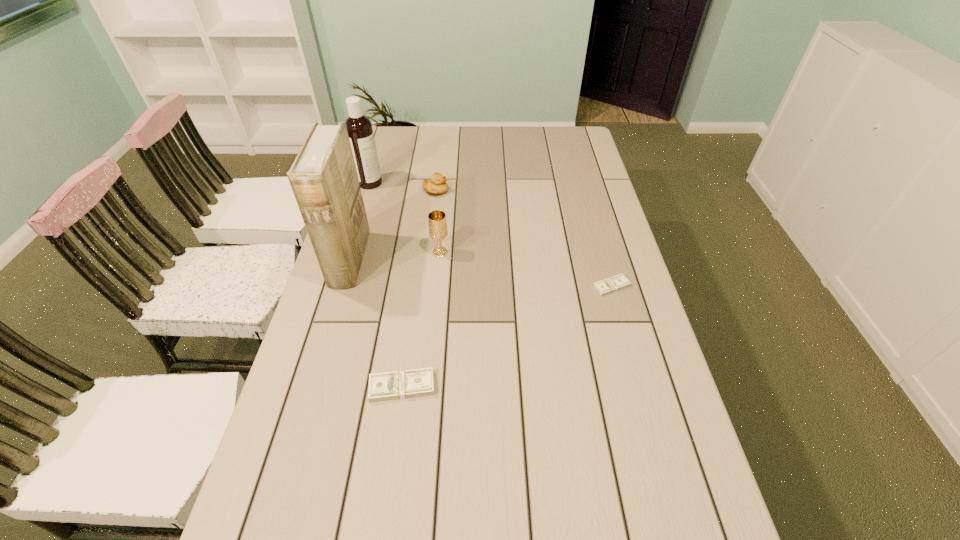
Where is `free location at the far right corner`? free location at the far right corner is located at coordinates (576, 143).

Identify the location of free space between the farther money and the third shortest object. The width and height of the screenshot is (960, 540). (523, 239).

You are a GUI agent. You are given a task and a screenshot of the screen. Output one action in this format:
    pyautogui.click(x=<x>, y=<y>)
    Task: Click on the free space between the dishwasher detergent and the nearest object
    This screenshot has height=540, width=960.
    Given the screenshot: What is the action you would take?
    pyautogui.click(x=386, y=285)

Find the location of `vacant region between the farther money and the fourth tallest object`. vacant region between the farther money and the fourth tallest object is located at coordinates (523, 239).

Where is `empty space between the second tallest object and the farther money`? This screenshot has height=540, width=960. empty space between the second tallest object and the farther money is located at coordinates (491, 234).

Find the location of a particular element. free point between the fourth shortest object and the dishwasher detergent is located at coordinates (405, 218).

The image size is (960, 540). In order to click on free space between the fourth shortest object and the dishwasher detergent in this screenshot , I will do `click(405, 218)`.

You are a GUI agent. You are given a task and a screenshot of the screen. Output one action in this format:
    pyautogui.click(x=<x>, y=<y>)
    Task: Click on the vacant area between the fourth shortest object and the second tallest object
    The height and width of the screenshot is (540, 960).
    Given the screenshot: What is the action you would take?
    pyautogui.click(x=405, y=218)

Where is `free space between the chalice and the fifth tallest object`? free space between the chalice and the fifth tallest object is located at coordinates (421, 320).

Select which object is the closest to the farther money. Please provide its 2D coordinates. Your answer should be formatted as a tuple, i.e. [(x, y)], where the tuple contains the x and y coordinates of a point satisfying the conditions above.

[(437, 223)]